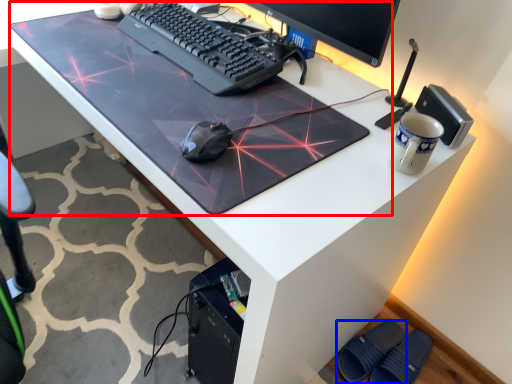
Question: Which object appears farthest to the camera in this image, table top (highlighted by a red box) or footwear (highlighted by a blue box)?

Choices:
 (A) table top
 (B) footwear

Answer: (B)